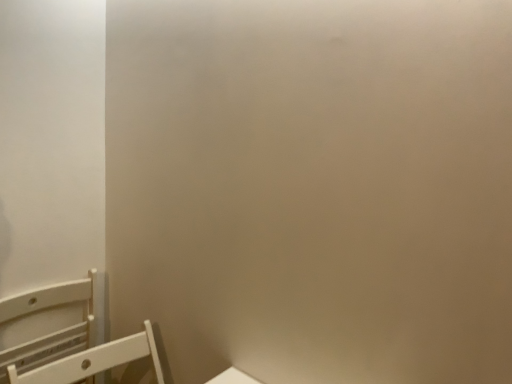
Question: From a real-world perspective, is white matte chair at lower left, marked as the second furniture in a left-to-right arrangement, physically below white plastic chair at lower left, the 1th furniture in the left-to-right sequence?

Choices:
 (A) yes
 (B) no

Answer: (B)

Question: Can you confirm if white matte chair at lower left, marked as the second furniture in a left-to-right arrangement, is wider than white plastic chair at lower left, the second furniture viewed from the right?

Choices:
 (A) yes
 (B) no

Answer: (A)

Question: Is white matte chair at lower left, the 1th furniture in the right-to-left sequence, in front of white plastic chair at lower left, the second furniture viewed from the right?

Choices:
 (A) no
 (B) yes

Answer: (B)

Question: Is white matte chair at lower left, the 1th furniture in the right-to-left sequence, located outside white plastic chair at lower left, the 1th furniture in the left-to-right sequence?

Choices:
 (A) yes
 (B) no

Answer: (A)

Question: Does white matte chair at lower left, the 1th furniture in the right-to-left sequence, lie behind white plastic chair at lower left, the second furniture viewed from the right?

Choices:
 (A) no
 (B) yes

Answer: (A)

Question: Does white matte chair at lower left, the 1th furniture in the right-to-left sequence, have a larger size compared to white plastic chair at lower left, the 1th furniture in the left-to-right sequence?

Choices:
 (A) yes
 (B) no

Answer: (A)

Question: Considering the relative sizes of white plastic chair at lower left, the second furniture viewed from the right, and white matte chair at lower left, the 1th furniture in the right-to-left sequence, in the image provided, is white plastic chair at lower left, the second furniture viewed from the right, taller than white matte chair at lower left, the 1th furniture in the right-to-left sequence,?

Choices:
 (A) no
 (B) yes

Answer: (B)

Question: Is white plastic chair at lower left, the 1th furniture in the left-to-right sequence, next to white matte chair at lower left, marked as the second furniture in a left-to-right arrangement, and touching it?

Choices:
 (A) no
 (B) yes

Answer: (A)

Question: Is white plastic chair at lower left, the second furniture viewed from the right, smaller than white matte chair at lower left, marked as the second furniture in a left-to-right arrangement?

Choices:
 (A) yes
 (B) no

Answer: (A)

Question: From the image's perspective, is white plastic chair at lower left, the second furniture viewed from the right, below white matte chair at lower left, marked as the second furniture in a left-to-right arrangement?

Choices:
 (A) no
 (B) yes

Answer: (A)

Question: Is white matte chair at lower left, marked as the second furniture in a left-to-right arrangement, a part of white plastic chair at lower left, the second furniture viewed from the right?

Choices:
 (A) yes
 (B) no

Answer: (B)

Question: Considering the relative sizes of white plastic chair at lower left, the 1th furniture in the left-to-right sequence, and white matte chair at lower left, the 1th furniture in the right-to-left sequence, in the image provided, is white plastic chair at lower left, the 1th furniture in the left-to-right sequence, shorter than white matte chair at lower left, the 1th furniture in the right-to-left sequence,?

Choices:
 (A) no
 (B) yes

Answer: (A)

Question: Is white matte chair at lower left, the 1th furniture in the right-to-left sequence, taller or shorter than white plastic chair at lower left, the 1th furniture in the left-to-right sequence?

Choices:
 (A) tall
 (B) short

Answer: (B)